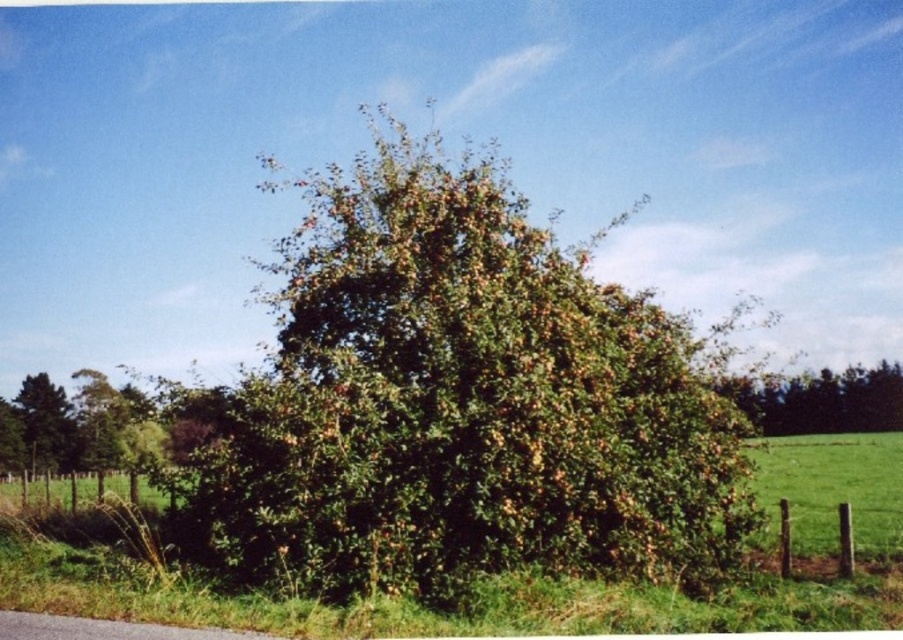
Question: Which point is farther to the camera?

Choices:
 (A) (812, 417)
 (B) (31, 449)

Answer: (A)

Question: Which point is closer to the camera taking this photo?

Choices:
 (A) (841, 429)
 (B) (426, 234)
 (C) (33, 392)

Answer: (B)

Question: Can you confirm if green leafy bush at center is positioned below green leafy bush at right?

Choices:
 (A) no
 (B) yes

Answer: (A)

Question: Among these points, which one is farthest from the camera?

Choices:
 (A) (273, 564)
 (B) (33, 467)
 (C) (880, 385)

Answer: (C)

Question: Is green leafy bush at center further to camera compared to green leafy tree at left?

Choices:
 (A) yes
 (B) no

Answer: (B)

Question: Is green leafy bush at right smaller than green leafy tree at left?

Choices:
 (A) yes
 (B) no

Answer: (B)